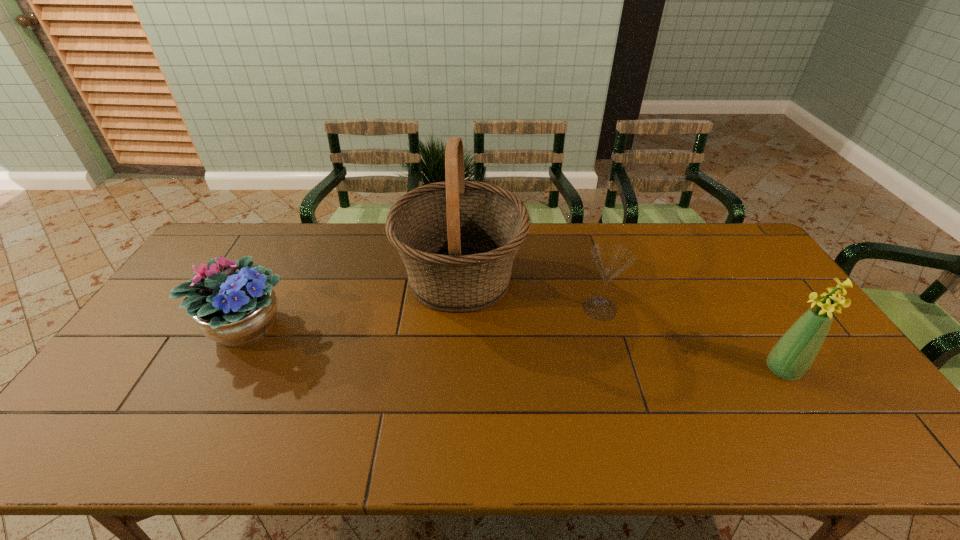
Find the location of a particular element. free space located on the front-facing side of the taller bouquet is located at coordinates (639, 370).

Where is `vacant space located 0.090m on the right of the shorter bouquet`? The width and height of the screenshot is (960, 540). vacant space located 0.090m on the right of the shorter bouquet is located at coordinates (324, 326).

Identify the location of vacant position located on the back of the third object from left to right. This screenshot has width=960, height=540. (590, 276).

This screenshot has width=960, height=540. I want to click on object that is at the far edge, so click(458, 239).

The height and width of the screenshot is (540, 960). Identify the location of object situated at the left edge. (235, 309).

Locate an element on the screen. Image resolution: width=960 pixels, height=540 pixels. object that is positioned at the right edge is located at coordinates (794, 353).

Locate an element on the screen. vacant region at the far edge of the desktop is located at coordinates (356, 236).

This screenshot has height=540, width=960. What are the coordinates of `vacant space at the near edge of the desktop` in the screenshot? It's located at (213, 443).

Where is `vacant area at the left edge of the desktop`? The height and width of the screenshot is (540, 960). vacant area at the left edge of the desktop is located at coordinates [190, 279].

Locate an element on the screen. This screenshot has height=540, width=960. vacant space at the right edge of the desktop is located at coordinates (732, 280).